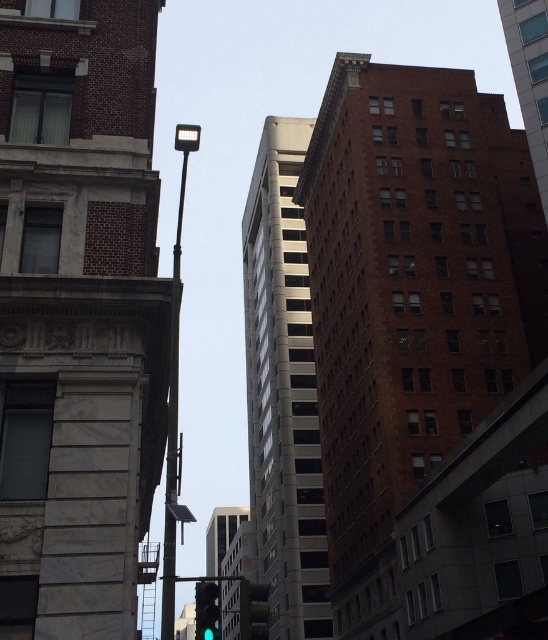
In the scene shown: Between metallic gray pole at center-left and green glass traffic light at center, which one has more height?

Standing taller between the two is metallic gray pole at center-left.

Which is in front, point (163, 540) or point (209, 586)?

Positioned in front is point (209, 586).

Which is behind, point (165, 557) or point (218, 618)?

The point (165, 557) is behind.

Locate an element on the screen. metallic gray pole at center-left is located at coordinates (173, 426).

Does metallic gray pole at center-left have a larger size compared to green matte traffic light at center?

Yes.

Does metallic gray pole at center-left appear on the left side of green matte traffic light at center?

Correct, you'll find metallic gray pole at center-left to the left of green matte traffic light at center.

Is point (168, 600) closer to camera compared to point (259, 637)?

No, it is not.

Locate an element on the screen. The width and height of the screenshot is (548, 640). metallic gray pole at center-left is located at coordinates (173, 426).

Does point (265, 596) lie in front of point (208, 620)?

No, it is behind (208, 620).

Which is in front, point (248, 604) or point (207, 598)?

Positioned in front is point (248, 604).

Where is `green matte traffic light at center`? green matte traffic light at center is located at coordinates (254, 611).